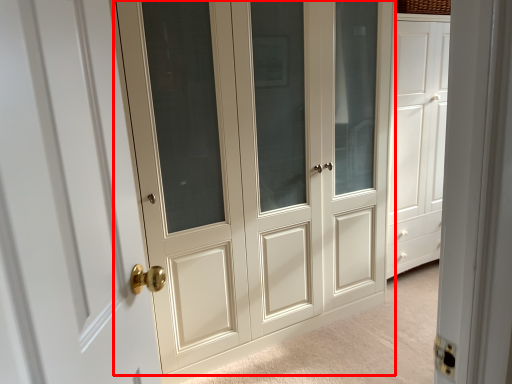
Question: From the image's perspective, where is door (annotated by the red box) located in relation to door in the image?

Choices:
 (A) above
 (B) below

Answer: (A)